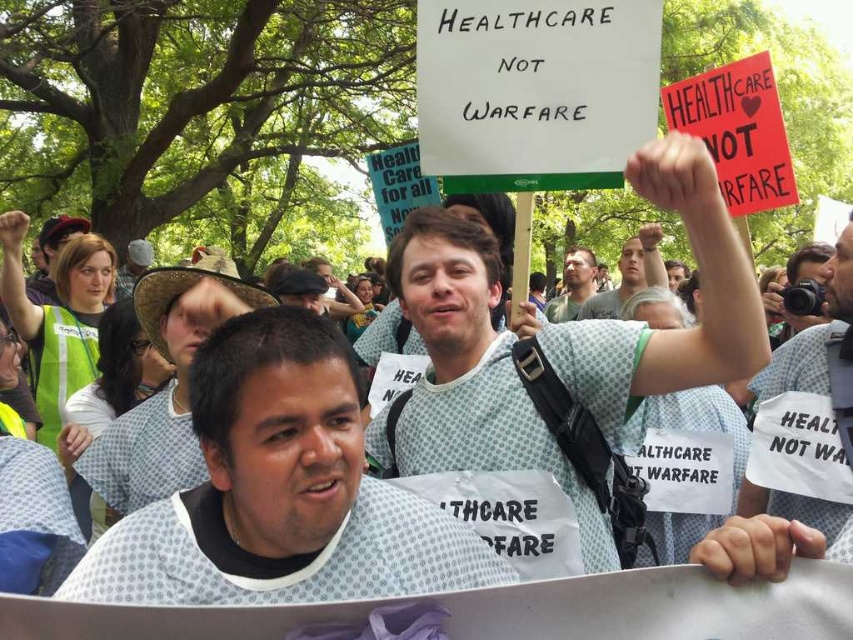
Is white fabric shirt at center behind light gray shirt at center?

No, white fabric shirt at center is in front of light gray shirt at center.

The height and width of the screenshot is (640, 853). What do you see at coordinates (280, 492) in the screenshot?
I see `white fabric shirt at center` at bounding box center [280, 492].

The height and width of the screenshot is (640, 853). Identify the location of white fabric shirt at center. (280, 492).

Is point (851, 273) less distant than point (572, 305)?

Yes, point (851, 273) is in front of point (572, 305).

The width and height of the screenshot is (853, 640). Find the location of `white paper sign at upper center`. white paper sign at upper center is located at coordinates (840, 275).

Is point (184, 577) positioned before point (486, 252)?

Yes, it is in front of point (486, 252).

Between white fabric shirt at center and white dotted hospital gown at center, which one has more height?

white dotted hospital gown at center is taller.

This screenshot has height=640, width=853. In order to click on white fabric shirt at center in this screenshot , I will do `click(280, 492)`.